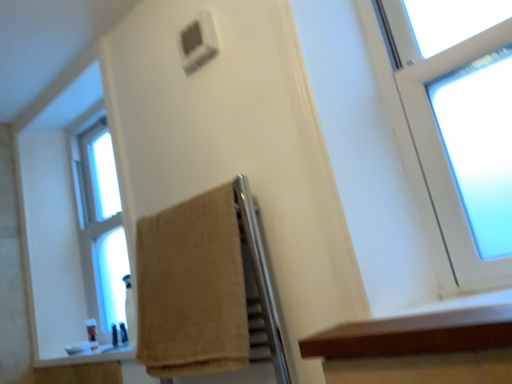
Question: Is point (86, 162) positioned closer to the camera than point (480, 309)?

Choices:
 (A) closer
 (B) farther

Answer: (B)

Question: In the image, is clear glass window at left positioned in front of or behind brown wood ledge at lower right?

Choices:
 (A) behind
 (B) front

Answer: (A)

Question: Estimate the real-world distances between objects in this image. Which object is farther from the translucent plastic soap at lower left?

Choices:
 (A) clear glass window at left
 (B) beige cotton towel at center
 (C) brown wood ledge at lower right

Answer: (C)

Question: Estimate the real-world distances between objects in this image. Which object is closer to the beige cotton towel at center?

Choices:
 (A) clear glass window at left
 (B) brown wood ledge at lower right
 (C) translucent plastic soap at lower left

Answer: (B)